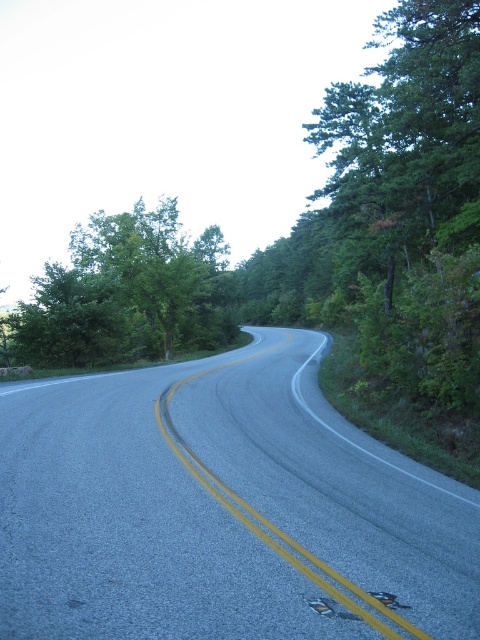
Can you confirm if gray asphalt road at center is bigger than green leafy tree at left?

Actually, gray asphalt road at center might be smaller than green leafy tree at left.

Consider the image. Between gray asphalt road at center and green leafy tree at left, which one is positioned lower?

Positioned lower is gray asphalt road at center.

The height and width of the screenshot is (640, 480). I want to click on gray asphalt road at center, so point(223,508).

The width and height of the screenshot is (480, 640). Identify the location of gray asphalt road at center. (223, 508).